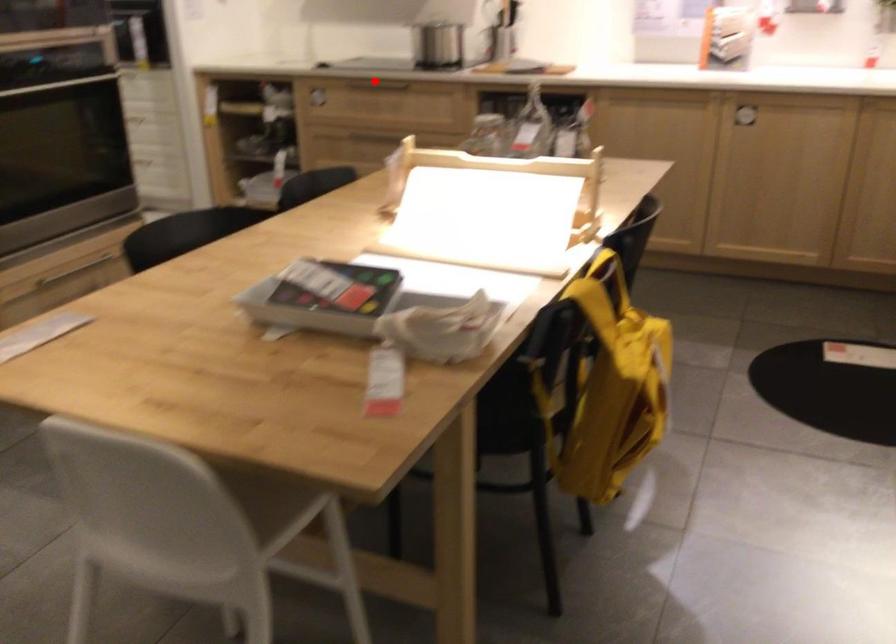
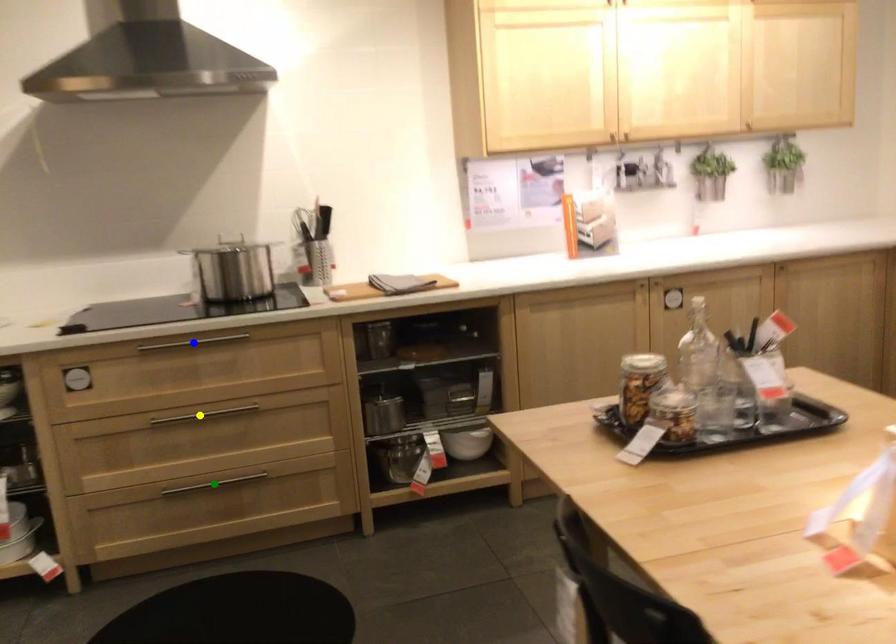
Question: I am providing you with two images of the same scene from different viewpoints. A red point is marked on the first image. You are given multiple points on the second image. Can you choose the point in image 2 that corresponds to the point in image 1?

Choices:
 (A) blue point
 (B) green point
 (C) yellow point

Answer: (A)